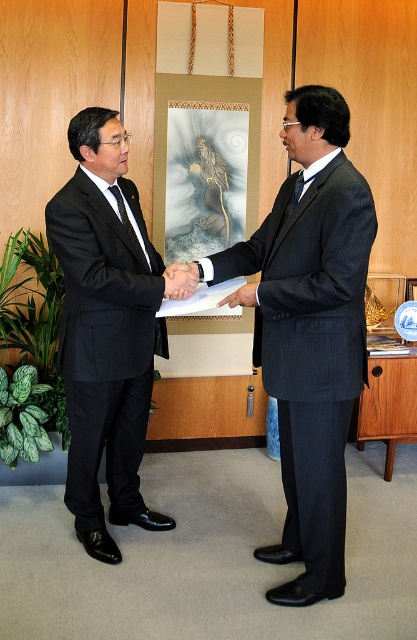
Does matte black handshake at center have a greater height compared to matte black hand at center?

Yes.

Which of these two, matte black handshake at center or matte black hand at center, stands shorter?

Standing shorter between the two is matte black hand at center.

Between point (165, 278) and point (253, 301), which one is positioned in front?

Point (253, 301) is in front.

The width and height of the screenshot is (417, 640). In order to click on matte black handshake at center in this screenshot , I will do `click(180, 280)`.

Does point (75, 179) come farther from viewer compared to point (128, 234)?

No, it is not.

Is point (80, 243) less distant than point (132, 237)?

Yes, it is in front of point (132, 237).

Between point (87, 464) and point (120, 216), which one is positioned behind?

The point (87, 464) is more distant.

I want to click on matte black suit at left, so click(x=105, y=328).

Between matte black tie at left and matte black hand at center, which one has less height?

Standing shorter between the two is matte black hand at center.

You are a GUI agent. You are given a task and a screenshot of the screen. Output one action in this format:
    pyautogui.click(x=<x>, y=<y>)
    Task: Click on the matte black tie at left
    
    Given the screenshot: What is the action you would take?
    click(x=128, y=225)